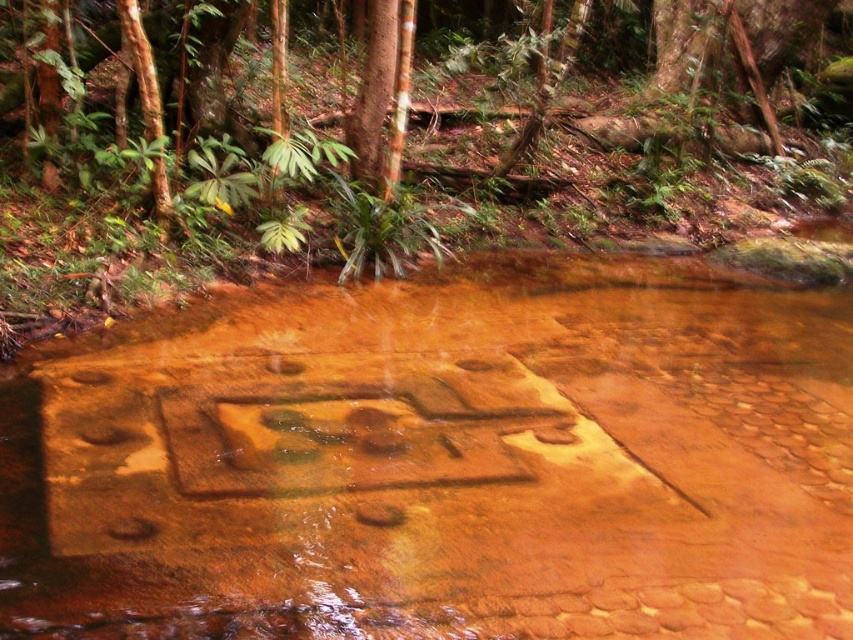
You are standing at the point labeled point (740, 342) in the forest scene. A friend is 5 meters away from you in the same direction. Can they see the carved face in the stream bed?

The point labeled point (740, 342) is 6.04 meters away from the viewer. Since your friend is 5 meters away from you in the same direction, they would be 11.04 meters from the carved face. The carved face is in the middle ground of the scene, so it might not be visible from that distance. However, the description does not provide information about visibility at that distance, so we cannot confirm if they can see it.

You are a hiker who wants to cross the stream safely. You notice the brown textured mud at center and the brown stone forest at center. Which area should you avoid stepping on to ensure stability?

You should avoid stepping on the brown textured mud at center because it has a lesser width compared to the brown stone forest at center, making it less stable and more likely to shift underfoot.

You are a hiker walking along the stream and want to reach the brown stone forest at center. Which direction should you move relative to the brown textured mud at center to get there?

You should move away from the brown textured mud at center, since the brown stone forest at center is further away from you than the brown textured mud at center.